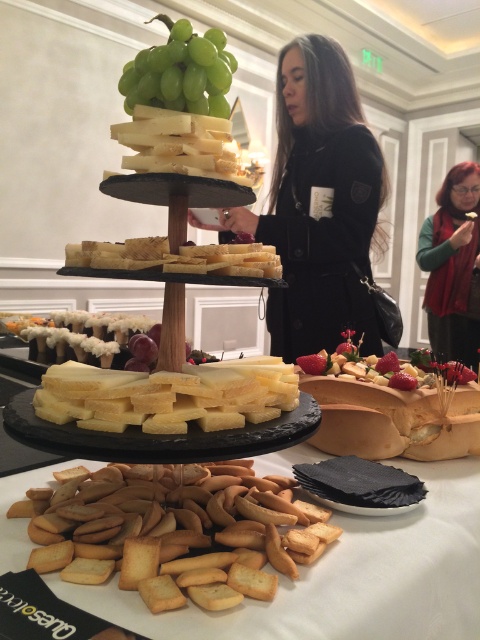
You are a guest at the event and want to place a small dish between the black matte jacket at center and the shiny gold tray at center. Considering their heights, which object should the dish be placed closer to?

The dish should be placed closer to the shiny gold tray at center because the black matte jacket at center is taller, so positioning the dish near the shorter shiny gold tray at center would ensure stability and balance.

You are a guest at the event and want to grab both the black matte jacket at center and the shiny gold tray at center. Since you can only reach one at a time, which one should you reach for first if you want to pick them up in order from left to right?

The black matte jacket at center is positioned on the left side of shiny gold tray at center, so you should reach for the black matte jacket at center first to follow the left to right order.

You are a guest at the event and want to take a cracker from the table. The yellow crumbly cheese at center and the white creamy cheese at center are both on the table. Which cheese is located to the right of the other?

The yellow crumbly cheese at center is positioned on the right side of white creamy cheese at center, so the yellow crumbly cheese at center is to the right of the white creamy cheese at center.